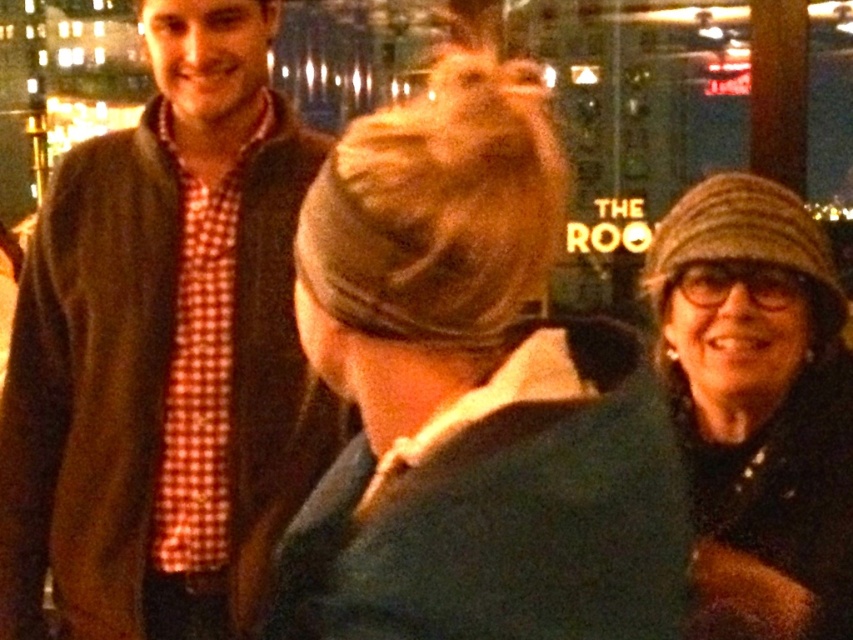
Question: Among these objects, which one is farthest from the camera?

Choices:
 (A) dark green fabric coat at center
 (B) striped wool hat at right

Answer: (A)

Question: Is dark green fabric coat at center below matte brown jacket at left?

Choices:
 (A) no
 (B) yes

Answer: (A)

Question: Does dark green fabric coat at center appear under matte brown jacket at left?

Choices:
 (A) no
 (B) yes

Answer: (A)

Question: Does matte brown jacket at left appear on the left side of striped wool hat at right?

Choices:
 (A) no
 (B) yes

Answer: (B)

Question: Which of the following is the farthest from the observer?

Choices:
 (A) striped wool hat at right
 (B) matte brown jacket at left
 (C) dark green fabric coat at center

Answer: (B)

Question: Which of these objects is positioned closest to the striped wool hat at right?

Choices:
 (A) dark green fabric coat at center
 (B) matte brown jacket at left

Answer: (A)